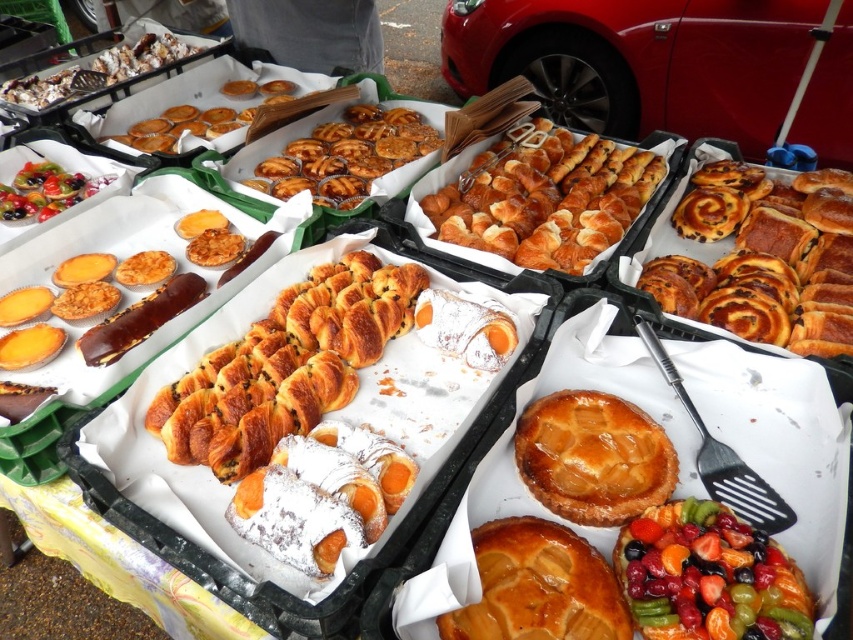
Question: Can you confirm if golden brown dough at right is positioned below fruity tart at center?

Choices:
 (A) yes
 (B) no

Answer: (B)

Question: Can you confirm if golden brown dough at right is thinner than golden glazed tart at center?

Choices:
 (A) no
 (B) yes

Answer: (A)

Question: Considering the real-world distances, which object is closest to the glossy plastic tray at upper left?

Choices:
 (A) golden flaky pie at center
 (B) golden brown flaky croissant at center
 (C) glossy golden pastries at center
 (D) golden glazed tart at center

Answer: (C)

Question: Which of these objects is positioned closest to the golden brown flaky croissant at center?

Choices:
 (A) golden glazed tart at center
 (B) glossy plastic tray at upper left
 (C) golden brown dough at right
 (D) golden brown croissant at center

Answer: (A)

Question: Can you confirm if golden brown dough at right is positioned above golden flaky pie at center?

Choices:
 (A) no
 (B) yes

Answer: (B)

Question: Estimate the real-world distances between objects in this image. Which object is farther from the glossy golden pastries at center?

Choices:
 (A) golden glazed tart at center
 (B) golden flaky pie at center
 (C) golden brown flaky croissant at center
 (D) glossy plastic tray at upper left

Answer: (B)